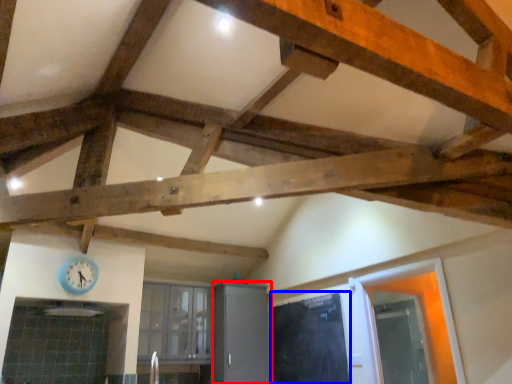
Question: Which point is closer to the camera, cabinetry (highlighted by a red box) or door (highlighted by a blue box)?

Choices:
 (A) cabinetry
 (B) door

Answer: (B)